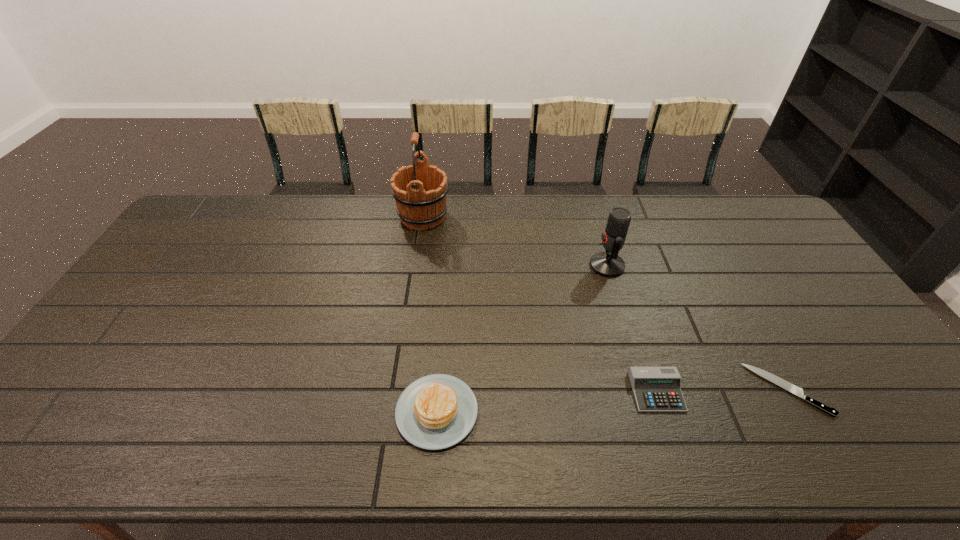
Where is `free space located on the side of the microphone with the red ring`? The height and width of the screenshot is (540, 960). free space located on the side of the microphone with the red ring is located at coordinates (565, 266).

I want to click on vacant space situated 0.340m on the side of the microphone with the red ring, so click(x=484, y=266).

The height and width of the screenshot is (540, 960). In order to click on free space located 0.210m on the left of the pancake in this screenshot , I will do `click(308, 411)`.

This screenshot has height=540, width=960. Identify the location of vacant region located 0.100m on the left of the fourth tallest object. (592, 392).

Identify the location of free spot located on the left of the shortest object. The height and width of the screenshot is (540, 960). (594, 389).

What are the coordinates of `object that is at the far edge` in the screenshot? It's located at (424, 207).

The image size is (960, 540). Find the location of `object positioned at the near edge`. object positioned at the near edge is located at coordinates (437, 411).

In order to click on vacant space at the far edge of the desktop in this screenshot , I will do `click(674, 222)`.

The width and height of the screenshot is (960, 540). In the image, there is a desktop. Find the location of `free space at the near edge`. free space at the near edge is located at coordinates (154, 423).

At what (x,y) coordinates should I click in order to perform the action: click on blank space at the left edge. Please return your answer as a coordinate pair (x, y). Looking at the image, I should click on click(183, 268).